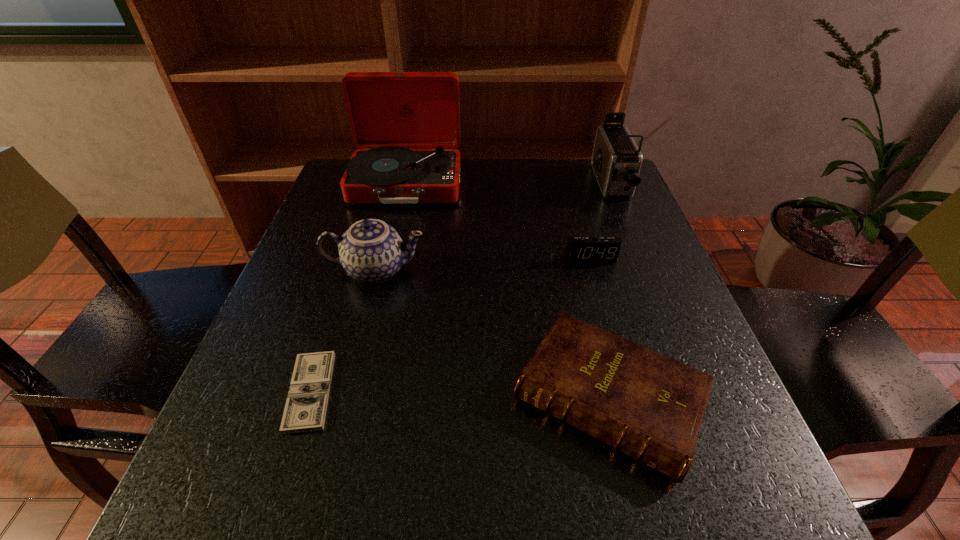
This screenshot has height=540, width=960. In order to click on object that stands as the closest to the third tallest object in this screenshot , I will do `click(305, 409)`.

You are a GUI agent. You are given a task and a screenshot of the screen. Output one action in this format:
    pyautogui.click(x=<x>, y=<y>)
    Task: Click on the vacant space that satisfies the following two spatial constraints: 1. on the front side of the hardback book; 2. on the left side of the shortest object
    Image resolution: width=960 pixels, height=540 pixels.
    Given the screenshot: What is the action you would take?
    pyautogui.click(x=308, y=399)

The height and width of the screenshot is (540, 960). In order to click on vacant space that satisfies the following two spatial constraints: 1. at the lens of the fifth shortest object; 2. from the spout of the chinaware in this screenshot , I will do `click(646, 270)`.

This screenshot has height=540, width=960. Identify the location of free space that satisfies the following two spatial constraints: 1. on the front-facing side of the alarm clock; 2. from the spout of the chinaware. (593, 270).